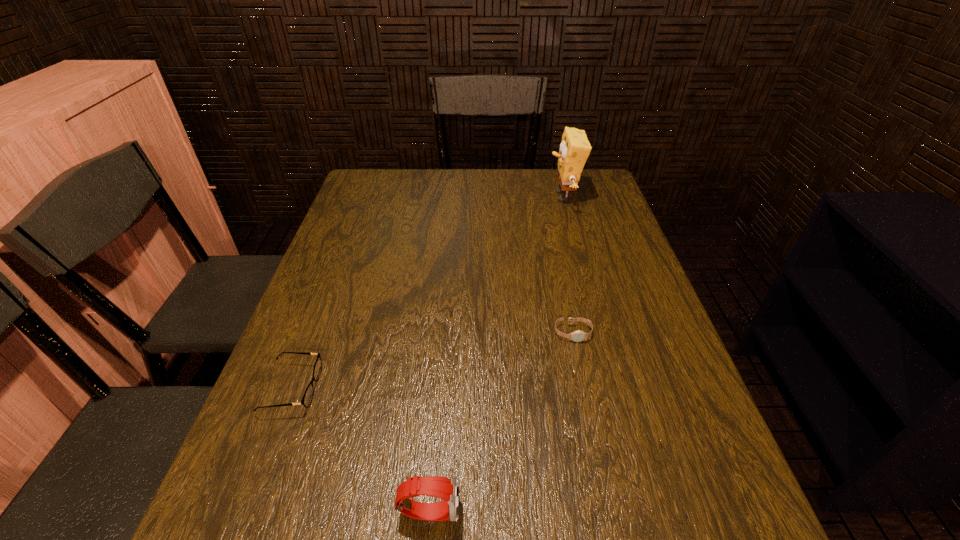
You are a GUI agent. You are given a task and a screenshot of the screen. Output one action in this format:
    pyautogui.click(x=<x>, y=<y>)
    Task: Click on the vacant area that lies between the tallest object and the second nearest object
    The width and height of the screenshot is (960, 540).
    Given the screenshot: What is the action you would take?
    pyautogui.click(x=427, y=293)

You are a GUI agent. You are given a task and a screenshot of the screen. Output one action in this format:
    pyautogui.click(x=<x>, y=<y>)
    Task: Click on the free spot between the spectacles and the farther watch
    Image resolution: width=960 pixels, height=540 pixels.
    Given the screenshot: What is the action you would take?
    pyautogui.click(x=432, y=361)

This screenshot has height=540, width=960. What are the coordinates of `vacant space that is in between the nearer watch and the sponge` in the screenshot? It's located at (496, 354).

This screenshot has height=540, width=960. Identify the location of the closest object to the spectacles. point(448,489).

Select which object appears as the second closest to the shorter watch. Please provide its 2D coordinates. Your answer should be formatted as a tuple, i.e. [(x, y)], where the tuple contains the x and y coordinates of a point satisfying the conditions above.

[(574, 150)]

You are a GUI agent. You are given a task and a screenshot of the screen. Output one action in this format:
    pyautogui.click(x=<x>, y=<y>)
    Task: Click on the blank space that satisfies the following two spatial constraints: 1. on the face of the shorter watch; 2. on the face of the left watch
    The image size is (960, 540).
    Given the screenshot: What is the action you would take?
    pyautogui.click(x=611, y=510)

This screenshot has height=540, width=960. In order to click on vacant area in the image that satisfies the following two spatial constraints: 1. on the face of the third nearest object; 2. on the front-facing side of the third farthest object in this screenshot , I will do `click(585, 388)`.

Locate an element on the screen. vacant space that satisfies the following two spatial constraints: 1. on the face of the farthest object; 2. on the face of the farther watch is located at coordinates (601, 333).

You are a GUI agent. You are given a task and a screenshot of the screen. Output one action in this format:
    pyautogui.click(x=<x>, y=<y>)
    Task: Click on the vacant space that satisfies the following two spatial constraints: 1. on the face of the farther watch; 2. on the face of the third object from right to left
    Image resolution: width=960 pixels, height=540 pixels.
    Given the screenshot: What is the action you would take?
    pyautogui.click(x=611, y=510)

Locate an element on the screen. free space that satisfies the following two spatial constraints: 1. on the face of the tallest object; 2. on the face of the right watch is located at coordinates click(601, 333).